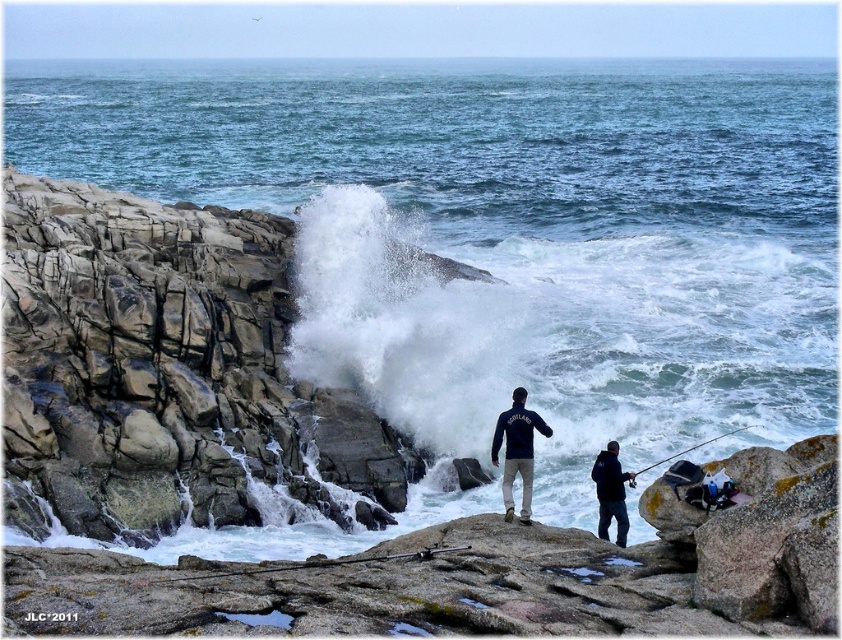
You are a photographer trying to capture both the metallic silver fishing pole at center and the black matte fishing pole at lower right in the same frame. Which fishing pole will appear closer to the camera in your photo?

The metallic silver fishing pole at center will appear closer to the camera because it is positioned in front of the black matte fishing pole at lower right.

You are a photographer planning to take a photo of the dark blue jacket at lower right and the metallic silver fishing pole at center. Which object should you zoom in on to capture more details of its texture without moving the camera?

You should zoom in on the dark blue jacket at lower right because it has a lesser width compared to the metallic silver fishing pole at center, allowing you to focus on its texture more closely without moving the camera.